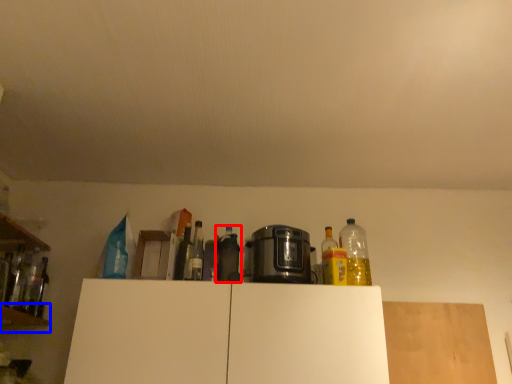
Question: Which of the following is the farthest to the observer, bottle (highlighted by a red box) or shelf (highlighted by a blue box)?

Choices:
 (A) bottle
 (B) shelf

Answer: (A)